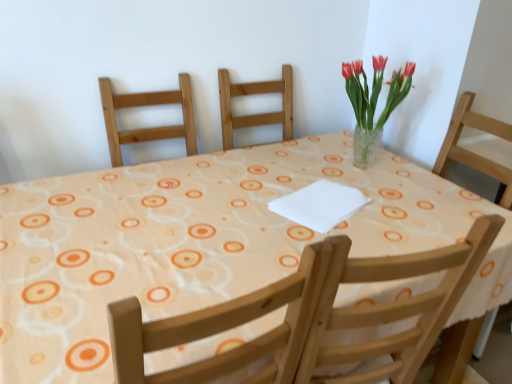
Question: Could wooden chair at upper center be considered to be inside clear glass vase at upper right?

Choices:
 (A) no
 (B) yes

Answer: (A)

Question: From a real-world perspective, is clear glass vase at upper right on top of wooden chair at upper center?

Choices:
 (A) no
 (B) yes

Answer: (B)

Question: Is clear glass vase at upper right positioned with its back to wooden chair at upper center?

Choices:
 (A) no
 (B) yes

Answer: (A)

Question: Is clear glass vase at upper right to the left of wooden chair at upper center from the viewer's perspective?

Choices:
 (A) no
 (B) yes

Answer: (B)

Question: Does clear glass vase at upper right have a lesser height compared to wooden chair at upper center?

Choices:
 (A) yes
 (B) no

Answer: (A)

Question: Is clear glass vase at upper right bigger than wooden chair at upper center?

Choices:
 (A) yes
 (B) no

Answer: (B)

Question: Could you tell me if white fabric at center is turned towards wooden chair at upper center?

Choices:
 (A) no
 (B) yes

Answer: (A)

Question: Can you confirm if white fabric at center is smaller than wooden chair at upper center?

Choices:
 (A) no
 (B) yes

Answer: (B)

Question: Is white fabric at center in front of wooden chair at upper center?

Choices:
 (A) no
 (B) yes

Answer: (B)

Question: From a real-world perspective, is white fabric at center on wooden chair at upper center?

Choices:
 (A) yes
 (B) no

Answer: (A)

Question: Is white fabric at center wider than wooden chair at upper center?

Choices:
 (A) yes
 (B) no

Answer: (A)

Question: Is white fabric at center behind wooden chair at upper center?

Choices:
 (A) yes
 (B) no

Answer: (B)

Question: Does white fabric at center have a lesser width compared to clear glass vase at upper right?

Choices:
 (A) no
 (B) yes

Answer: (A)